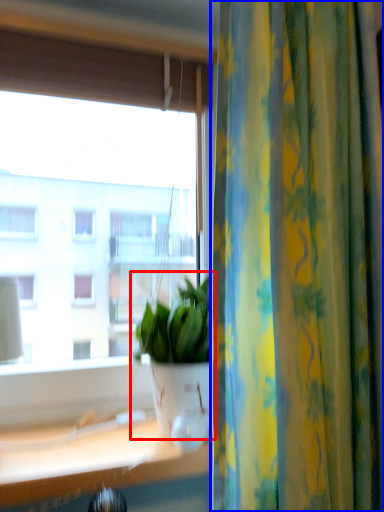
Question: Which object appears farthest to the camera in this image, houseplant (highlighted by a red box) or curtain (highlighted by a blue box)?

Choices:
 (A) houseplant
 (B) curtain

Answer: (A)